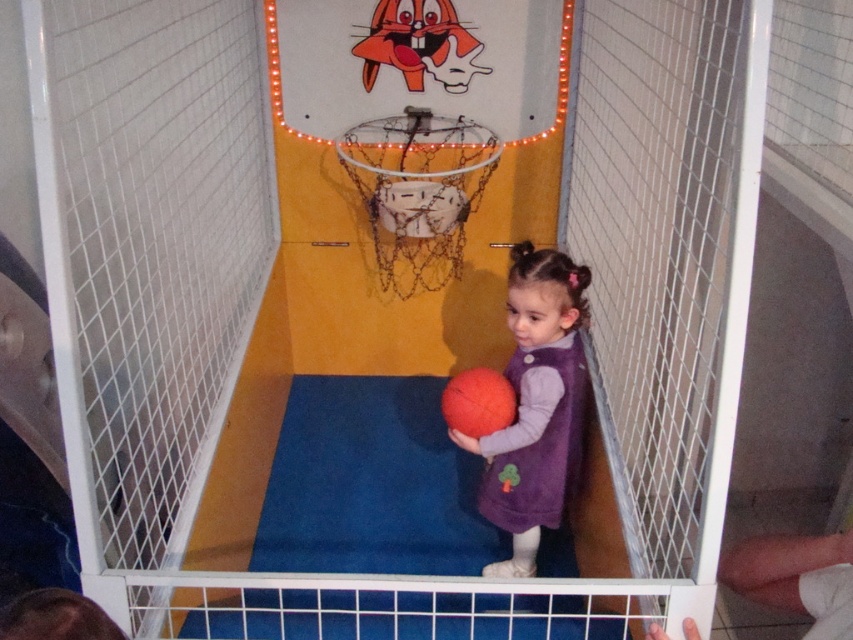
In the scene shown: Between purple fabric dress at center and rubber/spongy basketball at center, which one is positioned higher?

Positioned higher is rubber/spongy basketball at center.

Is point (512, 387) positioned behind point (459, 392)?

That is True.

Is point (523, 388) positioned in front of point (505, 417)?

No, (523, 388) is behind (505, 417).

You are a GUI agent. You are given a task and a screenshot of the screen. Output one action in this format:
    pyautogui.click(x=<x>, y=<y>)
    Task: Click on the purple fabric dress at center
    This screenshot has height=640, width=853.
    Given the screenshot: What is the action you would take?
    pyautogui.click(x=537, y=404)

Does white mesh basketball hoop at center appear on the right side of rubber/spongy basketball at center?

No, white mesh basketball hoop at center is not to the right of rubber/spongy basketball at center.

Who is taller, white mesh basketball hoop at center or rubber/spongy basketball at center?

With more height is white mesh basketball hoop at center.

The image size is (853, 640). What do you see at coordinates (418, 189) in the screenshot?
I see `white mesh basketball hoop at center` at bounding box center [418, 189].

Where is `white mesh basketball hoop at center`? The height and width of the screenshot is (640, 853). white mesh basketball hoop at center is located at coordinates (418, 189).

Is purple fabric dress at center to the right of white mesh basketball hoop at center from the viewer's perspective?

Correct, you'll find purple fabric dress at center to the right of white mesh basketball hoop at center.

Describe the element at coordinates (537, 404) in the screenshot. This screenshot has width=853, height=640. I see `purple fabric dress at center` at that location.

Find the location of a particular element. Image resolution: width=853 pixels, height=640 pixels. purple fabric dress at center is located at coordinates (537, 404).